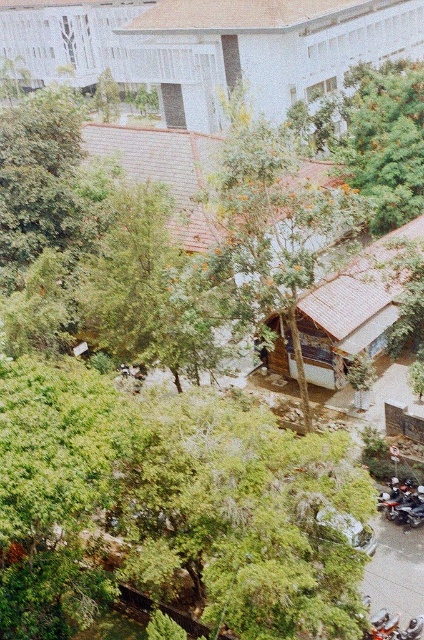
Consider the image. Can you confirm if green leafy tree at upper right is shorter than white wood hut at center?

No.

Between green leafy tree at upper right and white wood hut at center, which one appears on the right side from the viewer's perspective?

green leafy tree at upper right

Locate an element on the screen. This screenshot has height=640, width=424. green leafy tree at upper right is located at coordinates (x=384, y=140).

Which is in front, point (418, 161) or point (418, 516)?

Point (418, 516) is in front.

Is point (393, 90) farther from camera compared to point (399, 508)?

Yes, it is.

What do you see at coordinates (384, 140) in the screenshot? I see `green leafy tree at upper right` at bounding box center [384, 140].

Find the location of a particular element. The height and width of the screenshot is (640, 424). green leafy tree at upper right is located at coordinates tap(384, 140).

Between point (195, 124) and point (376, 150), which one is positioned behind?

Point (195, 124)

Is point (396, 13) farther from camera compared to point (354, 168)?

That is True.

Identify the location of brown wooden hut at upper center. [x=262, y=49].

This screenshot has width=424, height=640. Find the location of `brown wooden hut at upper center`. brown wooden hut at upper center is located at coordinates (262, 49).